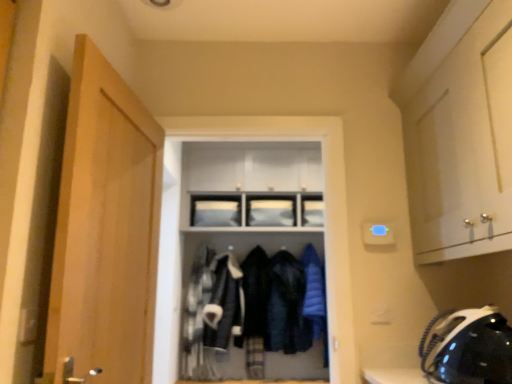
Question: Is the position of white glossy cabinet at upper right, arranged as the second cabinetry when viewed from the back, more distant than that of matte white cabinet at upper center, the 1th cabinetry positioned from the left?

Choices:
 (A) yes
 (B) no

Answer: (B)

Question: Does white glossy cabinet at upper right, which ranks as the first cabinetry in front-to-back order, lie in front of matte white cabinet at upper center, acting as the 2th cabinetry starting from the right?

Choices:
 (A) no
 (B) yes

Answer: (B)

Question: Is white glossy cabinet at upper right, the 1th cabinetry from the right, taller than matte white cabinet at upper center, acting as the 2th cabinetry starting from the right?

Choices:
 (A) no
 (B) yes

Answer: (B)

Question: Can you confirm if white glossy cabinet at upper right, which ranks as the first cabinetry in front-to-back order, is shorter than matte white cabinet at upper center, marked as the 1th cabinetry in a back-to-front arrangement?

Choices:
 (A) yes
 (B) no

Answer: (B)

Question: From the image's perspective, is white glossy cabinet at upper right, which ranks as the first cabinetry in front-to-back order, beneath matte white cabinet at upper center, marked as the 1th cabinetry in a back-to-front arrangement?

Choices:
 (A) yes
 (B) no

Answer: (B)

Question: Is white glossy cabinet at upper right, which appears as the 2th cabinetry when viewed from the left, located outside matte white cabinet at upper center, marked as the 1th cabinetry in a back-to-front arrangement?

Choices:
 (A) no
 (B) yes

Answer: (B)

Question: Considering the relative sizes of matte black coat rack at center and blue down jacket at center in the image provided, is matte black coat rack at center thinner than blue down jacket at center?

Choices:
 (A) no
 (B) yes

Answer: (A)

Question: From the image's perspective, does matte black coat rack at center appear higher than blue down jacket at center?

Choices:
 (A) no
 (B) yes

Answer: (B)

Question: Is blue down jacket at center completely or partially inside matte black coat rack at center?

Choices:
 (A) no
 (B) yes

Answer: (B)

Question: From the image's perspective, does matte black coat rack at center appear lower than blue down jacket at center?

Choices:
 (A) no
 (B) yes

Answer: (A)

Question: From a real-world perspective, is matte black coat rack at center under blue down jacket at center?

Choices:
 (A) no
 (B) yes

Answer: (A)

Question: Is matte black coat rack at center positioned in front of blue down jacket at center?

Choices:
 (A) no
 (B) yes

Answer: (B)

Question: Can you confirm if white glossy cabinet at upper right, which appears as the 2th cabinetry when viewed from the left, is shorter than black matte helmet at lower right?

Choices:
 (A) yes
 (B) no

Answer: (B)